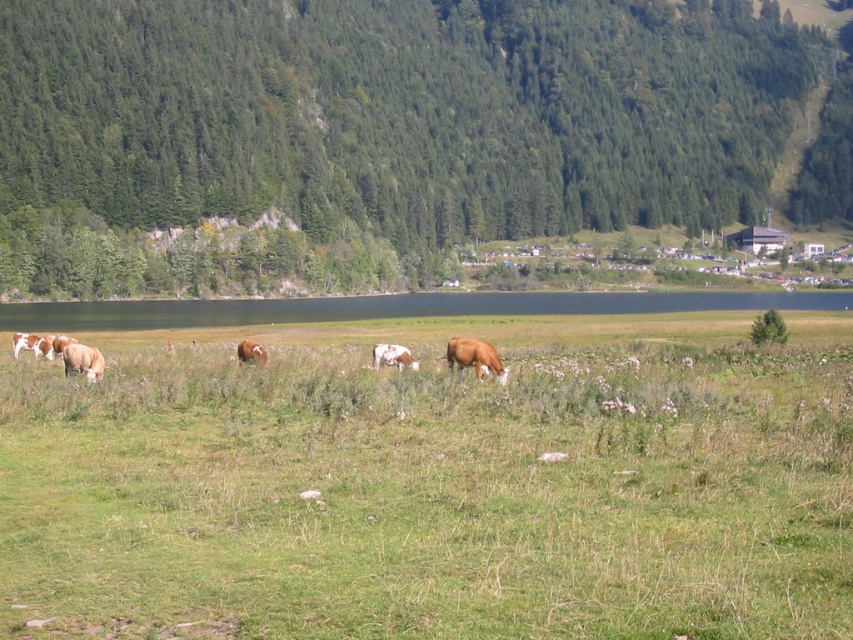
Question: Can you confirm if brown smooth cow at center is smaller than brown and white cow at left?

Choices:
 (A) no
 (B) yes

Answer: (B)

Question: Is green grassy field at center to the right of brown smooth cow at center from the viewer's perspective?

Choices:
 (A) yes
 (B) no

Answer: (B)

Question: Which object appears farthest from the camera in this image?

Choices:
 (A) brown speckled cow at lower left
 (B) brown and white cow at left
 (C) white speckled cow at center
 (D) green grassy field at center

Answer: (B)

Question: Which point is closer to the camera?

Choices:
 (A) brown furry cow at center
 (B) green forested hillside at upper center

Answer: (A)

Question: Where is brown smooth cow at center located in relation to brown and white cow at left in the image?

Choices:
 (A) below
 (B) above

Answer: (B)

Question: Among these points, which one is farthest from the camera?

Choices:
 (A) (671, 16)
 (B) (445, 358)

Answer: (A)